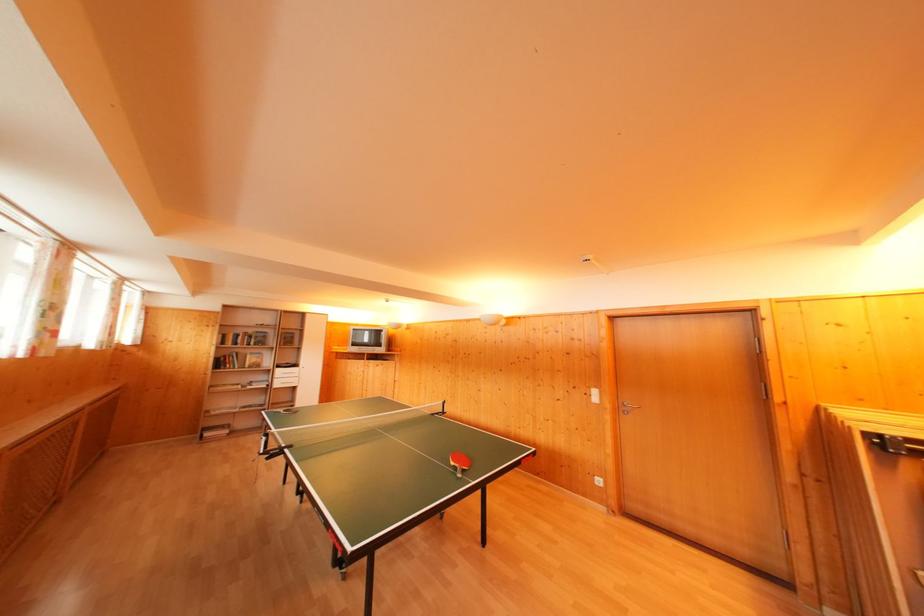
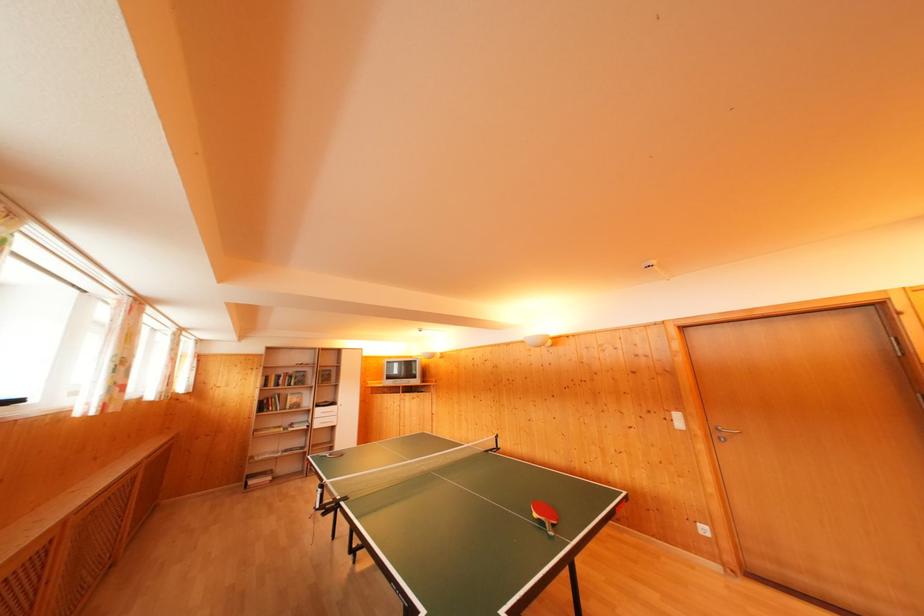
Where in the second image is the point corresponding to point (600, 398) from the first image?

(682, 421)